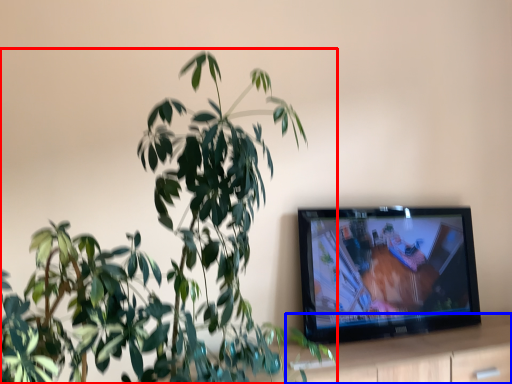
Question: Among these objects, which one is farthest to the camera, houseplant (highlighted by a red box) or dresser (highlighted by a blue box)?

Choices:
 (A) houseplant
 (B) dresser

Answer: (B)